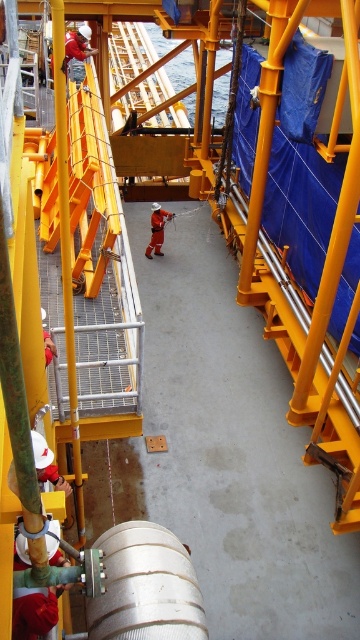
Could you measure the distance between silver metallic barrel at center and orange fabric construction worker at center?

A distance of 12.45 meters exists between silver metallic barrel at center and orange fabric construction worker at center.

Who is lower down, silver metallic barrel at center or orange fabric construction worker at center?

silver metallic barrel at center

Which is behind, point (146, 637) or point (158, 227)?

Point (158, 227)

I want to click on silver metallic barrel at center, so click(146, 586).